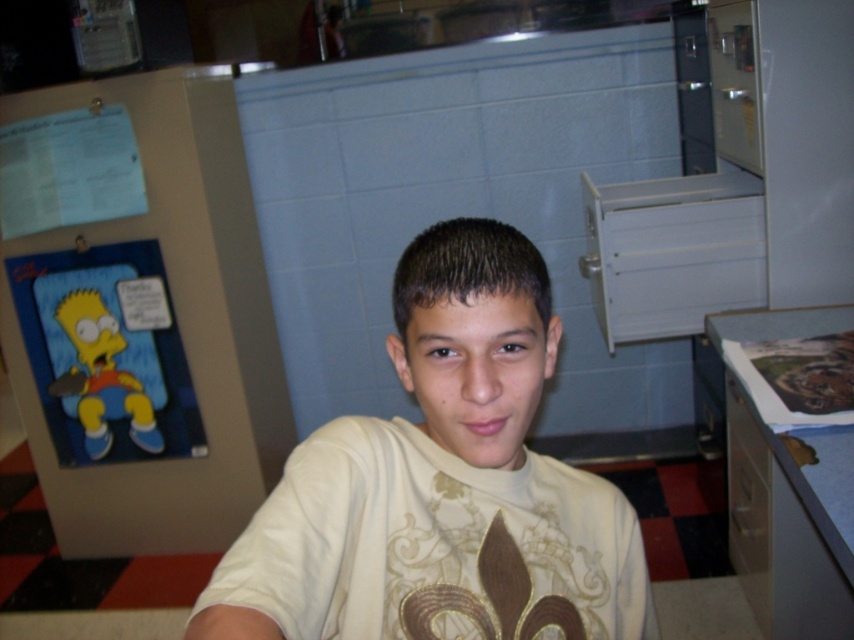
Question: Can you confirm if blue cardboard poster at left is wider than white matte shirt at center?

Choices:
 (A) yes
 (B) no

Answer: (A)

Question: Among these points, which one is nearest to the camera?

Choices:
 (A) 296,461
 (B) 114,284

Answer: (A)

Question: Which point is closer to the camera?

Choices:
 (A) (225, 582)
 (B) (244, 499)

Answer: (A)

Question: Does blue cardboard poster at left have a lesser width compared to white matte shirt at center?

Choices:
 (A) yes
 (B) no

Answer: (B)

Question: Can you confirm if blue cardboard poster at left is thinner than white matte shirt at center?

Choices:
 (A) no
 (B) yes

Answer: (A)